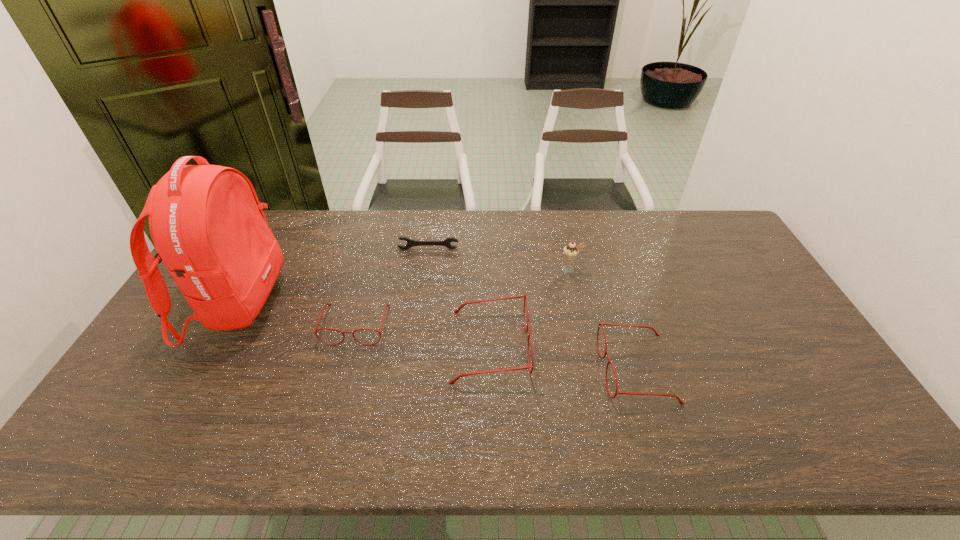
Where is `the leftmost spectacles`? the leftmost spectacles is located at coordinates (315, 331).

Where is `the second shortest object`? The width and height of the screenshot is (960, 540). the second shortest object is located at coordinates (315, 331).

I want to click on the second spectacles from left to right, so click(452, 382).

What are the coordinates of `the second shortest spectacles` in the screenshot? It's located at (606, 352).

What are the coordinates of `the third shortest object` in the screenshot? It's located at (606, 352).

You are a GUI agent. You are given a task and a screenshot of the screen. Output one action in this format:
    pyautogui.click(x=<x>, y=<y>)
    Task: Click on the icecream
    
    Given the screenshot: What is the action you would take?
    571,251

Find the location of a particular element. This screenshot has width=960, height=540. the farthest object is located at coordinates (410, 243).

Locate an element on the screen. This screenshot has height=540, width=960. wrench is located at coordinates (410, 243).

At what (x,y) coordinates should I click in order to perform the action: click on backpack. Please return your answer as a coordinate pair (x, y). This screenshot has width=960, height=540. Looking at the image, I should click on coord(206,222).

The image size is (960, 540). What are the coordinates of `the leftmost object` in the screenshot? It's located at 206,222.